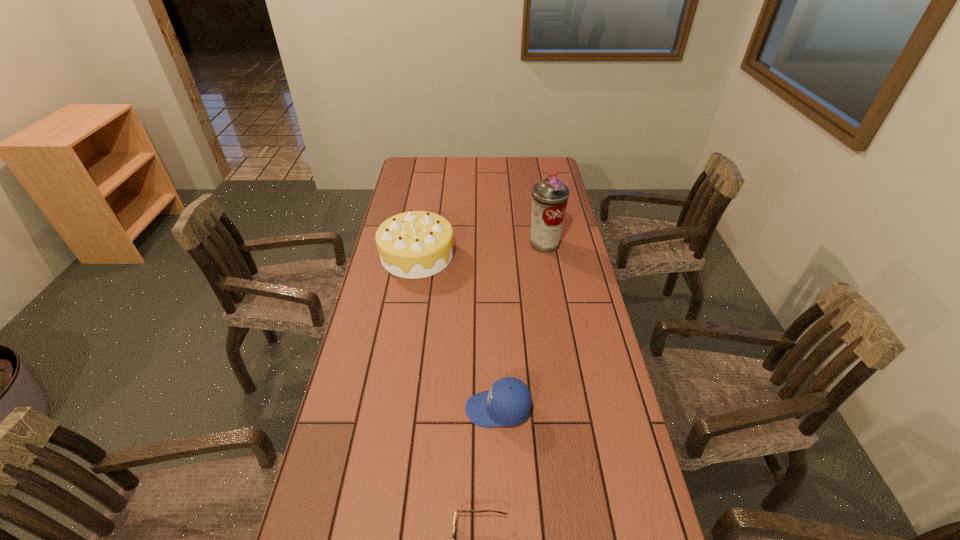
Where is `the rightmost object`? The image size is (960, 540). the rightmost object is located at coordinates (550, 196).

The height and width of the screenshot is (540, 960). Identify the location of the tallest object. pos(550,196).

In order to click on birthday cake in this screenshot , I will do `click(416, 244)`.

The height and width of the screenshot is (540, 960). Identify the location of the third shortest object. (416, 244).

Identify the location of the second nearest object. tap(508, 402).

Where is `cap`? cap is located at coordinates (508, 402).

Find the location of a particular element. This screenshot has width=960, height=540. blank space located on the left of the tallest object is located at coordinates (471, 244).

Locate an element on the screen. free spot located 0.170m on the back of the leftmost object is located at coordinates (425, 209).

You are a GUI agent. You are given a task and a screenshot of the screen. Output one action in this format:
    pyautogui.click(x=<x>, y=<y>)
    Task: Click on the free space located on the front-facing side of the cap
    This screenshot has width=960, height=540.
    Given the screenshot: What is the action you would take?
    pyautogui.click(x=422, y=409)

At what (x,y) coordinates should I click in order to perform the action: click on blank space located on the front-facing side of the cap. Please return your answer as a coordinate pair (x, y). Looking at the image, I should click on (415, 409).